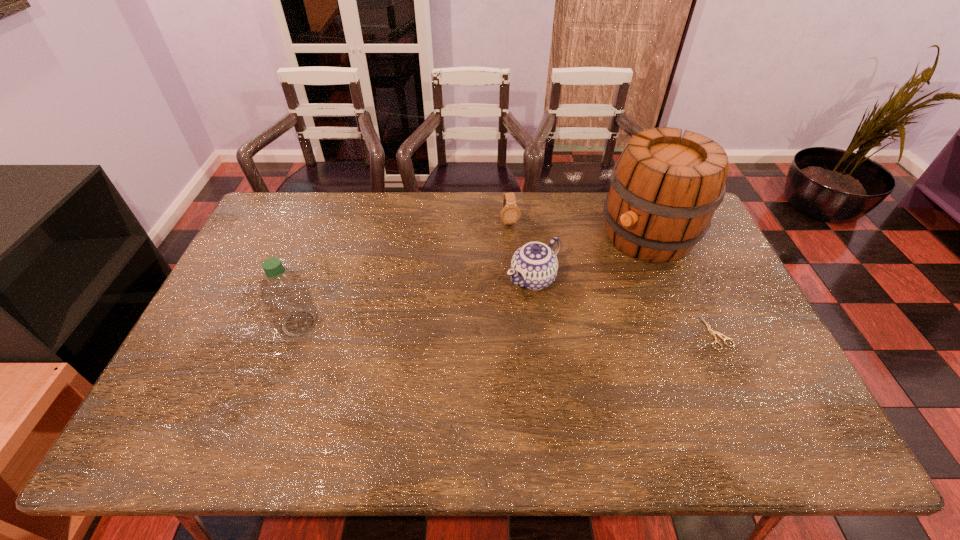
I want to click on cider that is at the right edge, so click(664, 190).

This screenshot has height=540, width=960. I want to click on object that is at the far right corner, so click(664, 190).

Where is `vacant space at the far edge of the desktop`? vacant space at the far edge of the desktop is located at coordinates (570, 197).

At what (x,y) coordinates should I click in order to perform the action: click on vacant space at the near edge of the desktop. Please return your answer as a coordinate pair (x, y). Looking at the image, I should click on (353, 379).

Where is `vacant space at the right edge`? The height and width of the screenshot is (540, 960). vacant space at the right edge is located at coordinates (716, 262).

Image resolution: width=960 pixels, height=540 pixels. In the image, there is a desktop. Identify the location of free space at the far left corner. (259, 227).

Find the location of a particular element. free spot between the tallest object and the shortest object is located at coordinates (683, 284).

Identify the location of vacant area that lies between the third tallest object and the cider. (590, 257).

You are a GUI agent. You are given a task and a screenshot of the screen. Output one action in this format:
    pyautogui.click(x=<x>, y=<y>)
    Task: Click on the free space between the watch and the fourth shortest object
    Image resolution: width=960 pixels, height=540 pixels.
    Given the screenshot: What is the action you would take?
    pyautogui.click(x=404, y=273)

Where is `vacant space that's between the leftmost object and the shortest object`? The image size is (960, 540). vacant space that's between the leftmost object and the shortest object is located at coordinates (508, 328).